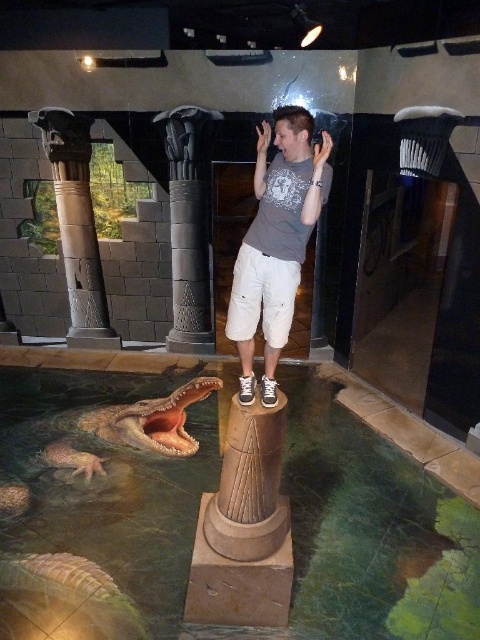
Question: Does gray cotton t-shirt at center appear over brown stone column at left?

Choices:
 (A) no
 (B) yes

Answer: (A)

Question: Which object appears farthest from the camera in this image?

Choices:
 (A) gray cotton t-shirt at center
 (B) brown stone column at left

Answer: (B)

Question: Does gray cotton t-shirt at center lie in front of brown stone column at left?

Choices:
 (A) yes
 (B) no

Answer: (A)

Question: Which object is farther from the camera taking this photo?

Choices:
 (A) brown stone column at left
 (B) gray cotton t-shirt at center

Answer: (A)

Question: Considering the relative positions of gray cotton t-shirt at center and brown stone column at left in the image provided, where is gray cotton t-shirt at center located with respect to brown stone column at left?

Choices:
 (A) below
 (B) above

Answer: (A)